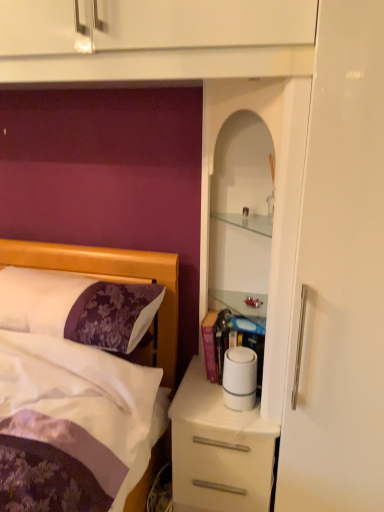
Locate an element on the screen. The height and width of the screenshot is (512, 384). free location to the left of white matte toilet paper at center is located at coordinates (198, 401).